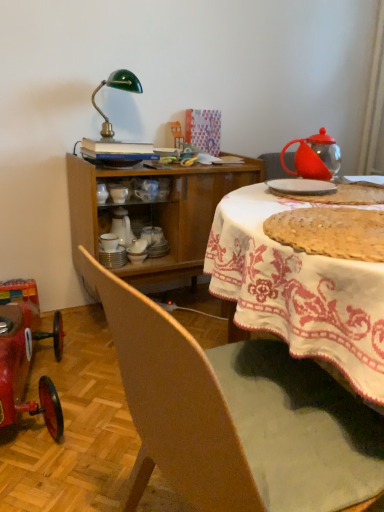
The height and width of the screenshot is (512, 384). I want to click on free point in front of white ceramic plate at upper center, placed as the fourth tableware when sorted from left to right, so click(x=336, y=204).